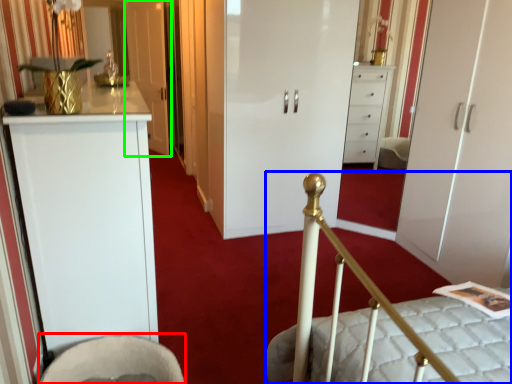
Question: Which object is the closest to the rocking chair (highlighted by a red box)? Choose among these: bed (highlighted by a blue box) or door (highlighted by a green box).

Choices:
 (A) bed
 (B) door

Answer: (A)